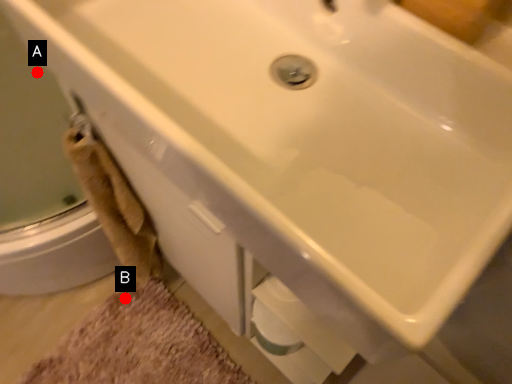
Question: Two points are circled on the image, labeled by A and B beside each circle. Which point is farther from the camera taking this photo?

Choices:
 (A) A is further
 (B) B is further

Answer: (B)